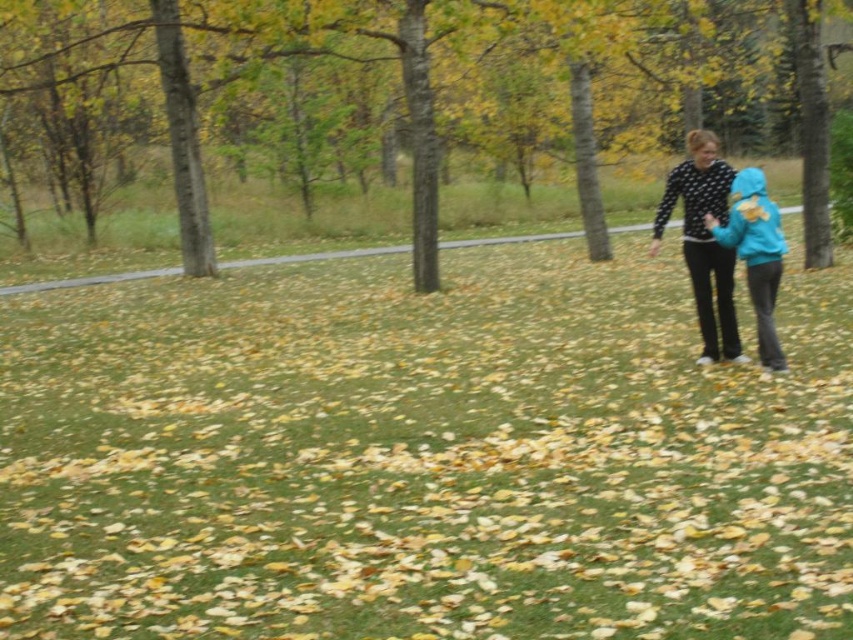
Consider the image. Is black dotted sweater at right thinner than blue fleece jacket at right?

No, black dotted sweater at right is not thinner than blue fleece jacket at right.

Does black dotted sweater at right appear on the right side of blue fleece jacket at right?

Correct, you'll find black dotted sweater at right to the right of blue fleece jacket at right.

Measure the distance between black dotted sweater at right and camera.

black dotted sweater at right and camera are 28.60 feet apart from each other.

Image resolution: width=853 pixels, height=640 pixels. Find the location of `black dotted sweater at right`. black dotted sweater at right is located at coordinates (703, 241).

From the picture: Which is below, brown bark tree at center or blue fleece jacket at right?

blue fleece jacket at right is lower down.

Does brown bark tree at center have a greater height compared to blue fleece jacket at right?

Correct, brown bark tree at center is much taller as blue fleece jacket at right.

Find the location of a particular element. brown bark tree at center is located at coordinates (500, 77).

Find the location of a particular element. The height and width of the screenshot is (640, 853). brown bark tree at center is located at coordinates (500, 77).

Which is more to the left, brown bark tree at center or black dotted sweater at right?

brown bark tree at center

Which is below, brown bark tree at center or black dotted sweater at right?

Positioned lower is black dotted sweater at right.

Locate an element on the screen. Image resolution: width=853 pixels, height=640 pixels. brown bark tree at center is located at coordinates (500, 77).

You are a GUI agent. You are given a task and a screenshot of the screen. Output one action in this format:
    pyautogui.click(x=<x>, y=<y>)
    Task: Click on the brown bark tree at center
    Image resolution: width=853 pixels, height=640 pixels.
    Given the screenshot: What is the action you would take?
    pyautogui.click(x=500, y=77)